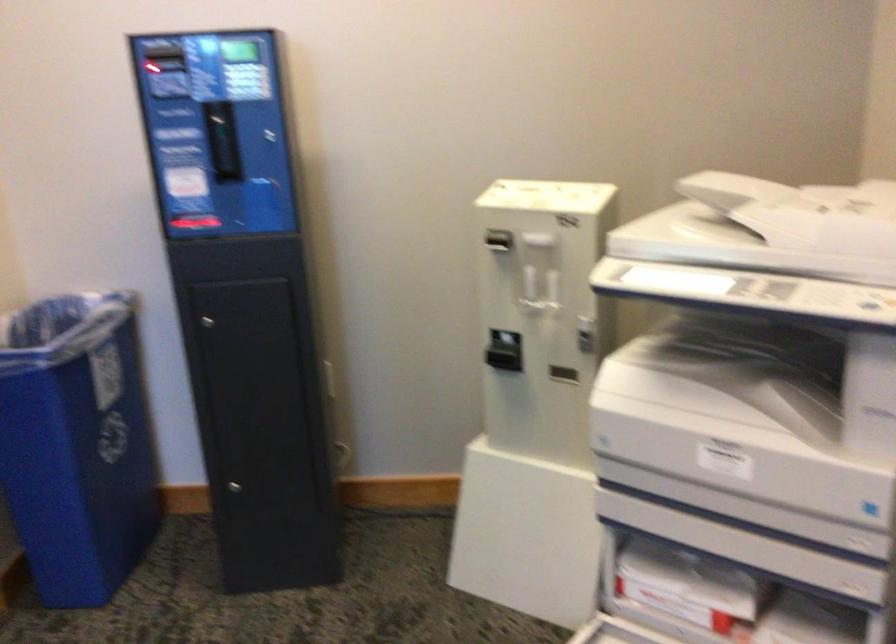
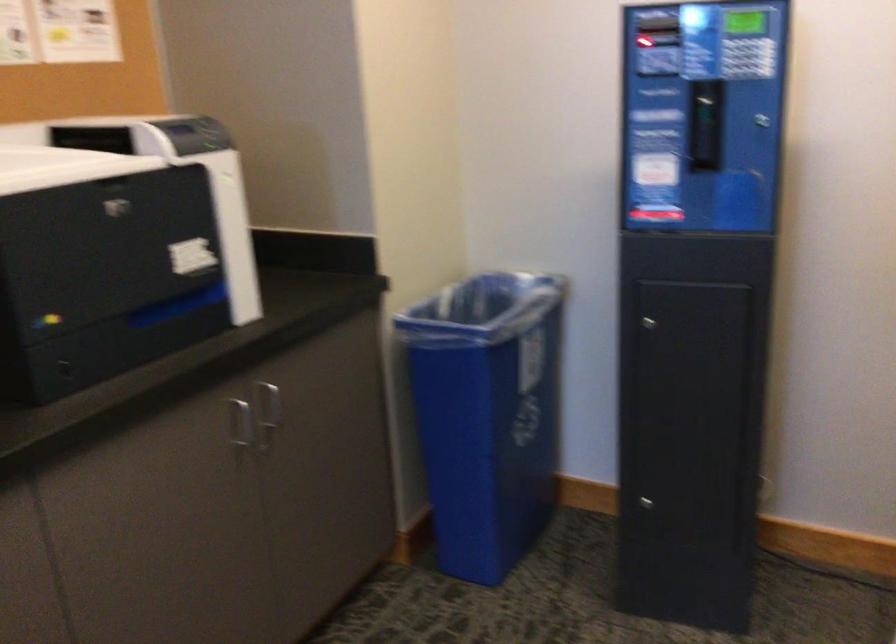
Find the pixel in the second image that matches point (72, 431) in the first image.

(487, 413)